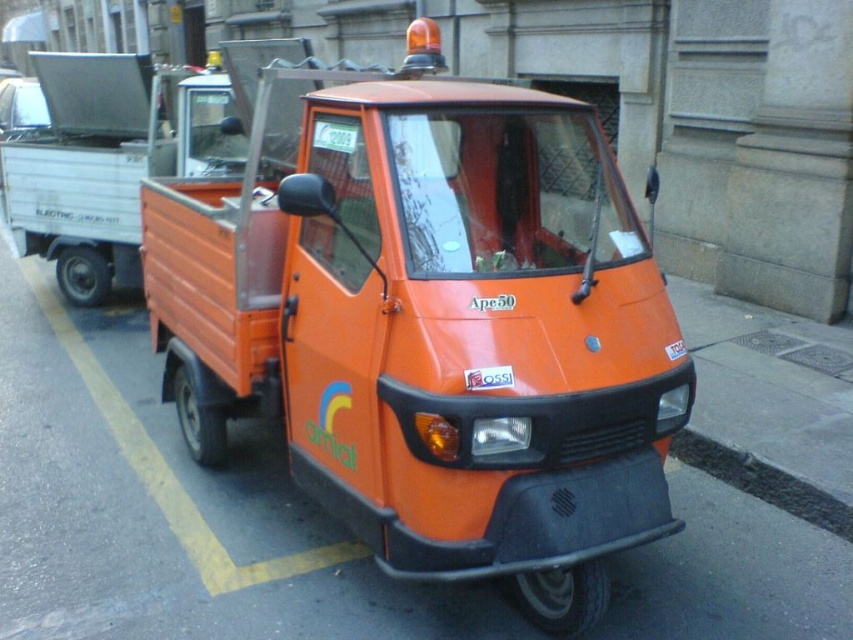
Describe the element at coordinates (107, 163) in the screenshot. The width and height of the screenshot is (853, 640). I see `orange matte truck at left` at that location.

Between orange matte truck at left and matte black truck at upper left, which one appears on the right side from the viewer's perspective?

orange matte truck at left is more to the right.

Between point (140, 278) and point (35, 125), which one is positioned in front?

Point (140, 278)

I want to click on orange matte truck at left, so click(107, 163).

Which is above, orange matte truck at center or matte black truck at upper left?

matte black truck at upper left is higher up.

Is orange matte truck at center wider than matte black truck at upper left?

No.

Where is `orange matte truck at center`? This screenshot has width=853, height=640. orange matte truck at center is located at coordinates (431, 323).

Is matte black truck at upper left positioned before green plastic license plate at center?

No, matte black truck at upper left is behind green plastic license plate at center.

From the picture: Is matte black truck at upper left bigger than green plastic license plate at center?

Correct, matte black truck at upper left is larger in size than green plastic license plate at center.

Which is behind, point (4, 96) or point (328, 138)?

Point (4, 96)

Where is `matte black truck at upper left`? matte black truck at upper left is located at coordinates (21, 106).